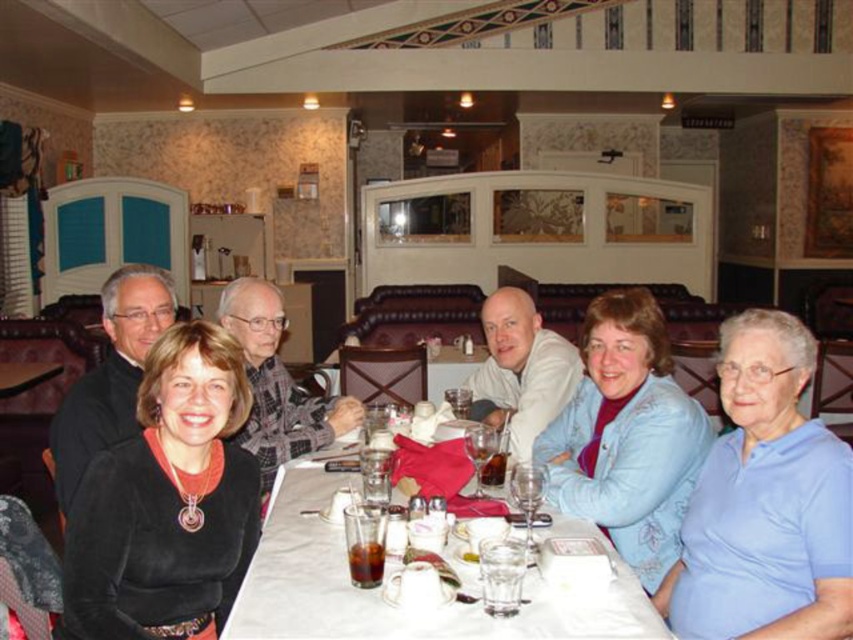
Is blue satin jacket at center bigger than plaid fabric shirt at center?

Indeed, blue satin jacket at center has a larger size compared to plaid fabric shirt at center.

Is blue satin jacket at center below plaid fabric shirt at center?

Indeed, blue satin jacket at center is positioned under plaid fabric shirt at center.

Who is more forward, (666,417) or (328,413)?

Point (666,417)

Locate an element on the screen. The width and height of the screenshot is (853, 640). blue satin jacket at center is located at coordinates (625, 436).

The width and height of the screenshot is (853, 640). What are the coordinates of `light blue cotton shirt at lower right` in the screenshot? It's located at point(764,502).

Between light blue cotton shirt at lower right and matte black sweater at left, which one appears on the left side from the viewer's perspective?

From the viewer's perspective, matte black sweater at left appears more on the left side.

Between point (740, 605) and point (142, 308), which one is positioned behind?

The point (142, 308) is behind.

Find the location of a particular element. Image resolution: width=853 pixels, height=640 pixels. light blue cotton shirt at lower right is located at coordinates (764, 502).

Does blue satin jacket at center have a greater height compared to white matte shirt at center?

Yes.

Is blue satin jacket at center shorter than white matte shirt at center?

No.

In order to click on blue satin jacket at center in this screenshot , I will do `click(625, 436)`.

This screenshot has width=853, height=640. Find the location of `blue satin jacket at center`. blue satin jacket at center is located at coordinates (625, 436).